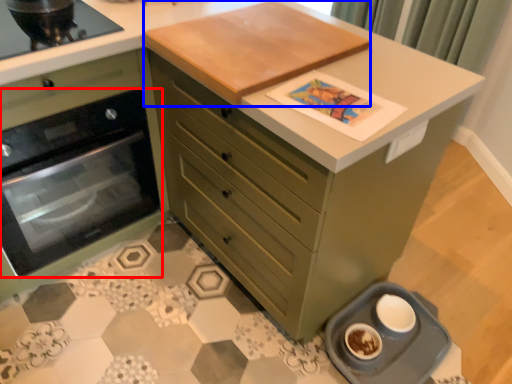
Question: Among these objects, which one is farthest to the camera, kitchen appliance (highlighted by a red box) or table top (highlighted by a blue box)?

Choices:
 (A) kitchen appliance
 (B) table top

Answer: (A)